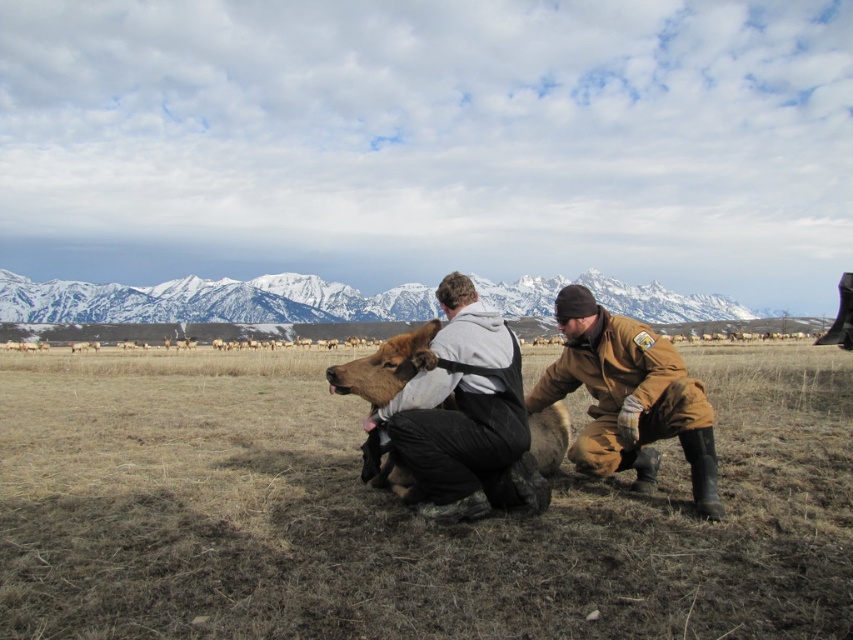
Question: Does dark brown fur at center have a greater width compared to brown leather jacket at lower right?

Choices:
 (A) yes
 (B) no

Answer: (A)

Question: Is brown dry grass at center below dark brown fur at center?

Choices:
 (A) yes
 (B) no

Answer: (A)

Question: Which object is positioned farthest from the brown dry grass at center?

Choices:
 (A) dark brown fur at center
 (B) brown leather jacket at lower right

Answer: (B)

Question: Which object is closer to the camera taking this photo?

Choices:
 (A) brown dry grass at center
 (B) dark brown fur at center

Answer: (A)

Question: Which point is farther to the camera?

Choices:
 (A) pyautogui.click(x=602, y=333)
 (B) pyautogui.click(x=468, y=284)

Answer: (B)

Question: Can you confirm if dark brown fur at center is bigger than brown leather jacket at lower right?

Choices:
 (A) yes
 (B) no

Answer: (B)